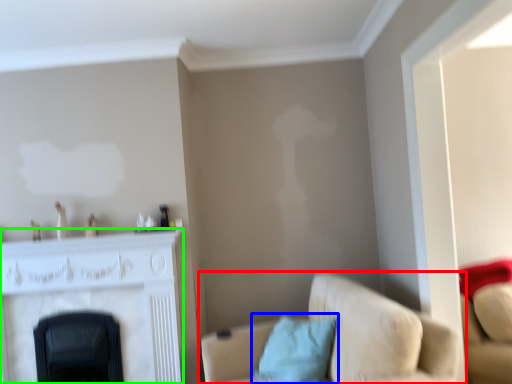
Question: Considering the real-world distances, which object is closest to studio couch (highlighted by a red box)? pillow (highlighted by a blue box) or fireplace (highlighted by a green box).

Choices:
 (A) pillow
 (B) fireplace

Answer: (A)